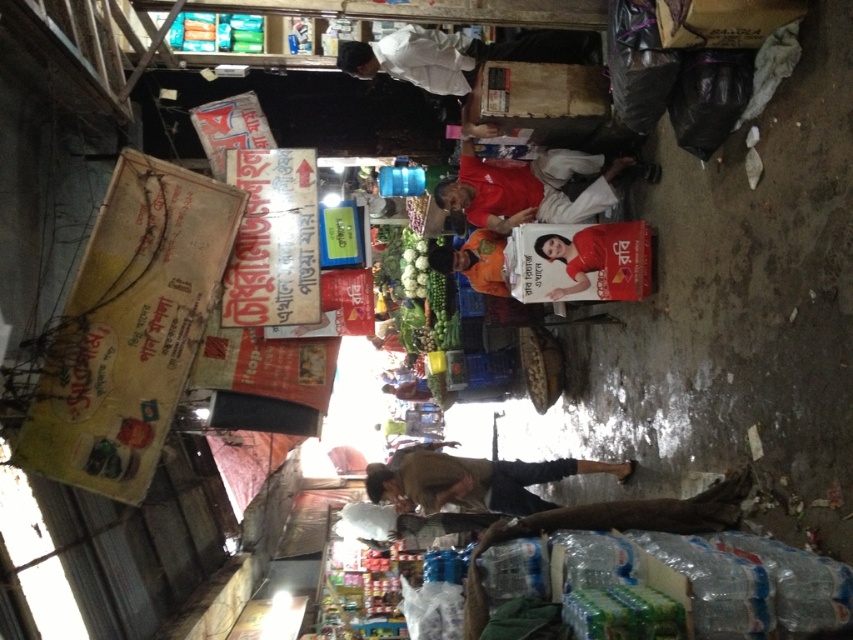
You are standing at the market entrance and want to reach both points in the image. Which point, point (421, 48) or point (630, 268), will you reach first as you walk towards them?

You will reach point (421, 48) first because it is closer to you than point (630, 268).

From the picture: You are a customer at this market and want to ask the vendor about the white cloth at upper center and the smooth plastic poster at center. Which one is positioned higher in the scene?

The white cloth at upper center is located above the smooth plastic poster at center, so it is positioned higher.